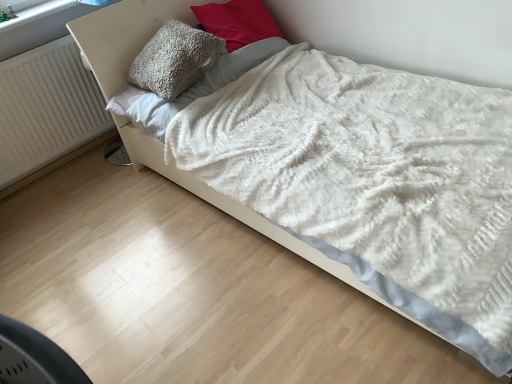
What are the coordinates of `vacant area on top of white plastic window frame at upper left (from a real-world perspective)` in the screenshot? It's located at (34, 10).